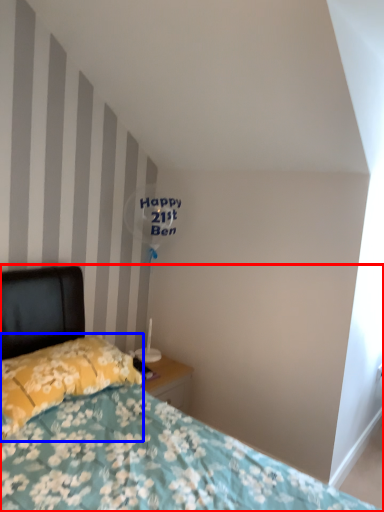
Question: Which point is further to the camera, bed (highlighted by a red box) or pillow (highlighted by a blue box)?

Choices:
 (A) bed
 (B) pillow

Answer: (B)